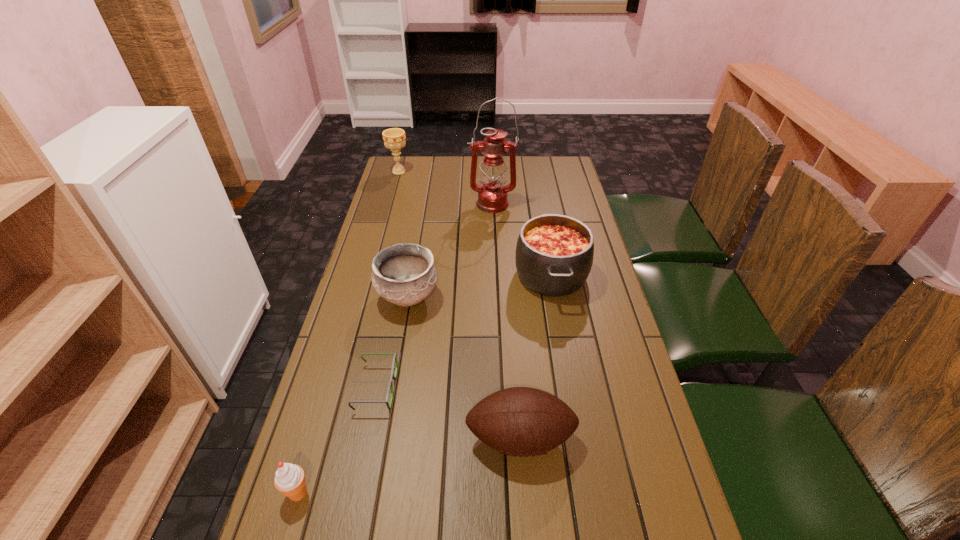
Locate an element on the screen. The height and width of the screenshot is (540, 960). vacant space located on the front of the casserole is located at coordinates (573, 400).

This screenshot has height=540, width=960. I want to click on vacant space located on the front of the pottery, so click(394, 377).

At what (x,y) coordinates should I click in order to perform the action: click on free space located on the laces of the football. Please return your answer as a coordinate pair (x, y). This screenshot has width=960, height=540. Looking at the image, I should click on click(x=527, y=530).

You are a GUI agent. You are given a task and a screenshot of the screen. Output one action in this format:
    pyautogui.click(x=<x>, y=<y>)
    Task: Click on the free region located on the right of the icecream
    The image size is (960, 540).
    Given the screenshot: What is the action you would take?
    pyautogui.click(x=473, y=492)

Identify the location of free space located on the lens of the shortest object. Image resolution: width=960 pixels, height=540 pixels. (471, 388).

Locate an element on the screen. object located in the far edge section of the desktop is located at coordinates [394, 138].

The image size is (960, 540). Identify the location of chalice present at the left edge. (394, 138).

The height and width of the screenshot is (540, 960). I want to click on pottery located in the left edge section of the desktop, so click(x=404, y=274).

Identify the location of icecream situated at the left edge. (290, 480).

The width and height of the screenshot is (960, 540). Identify the location of spectacles that is at the left edge. (393, 376).